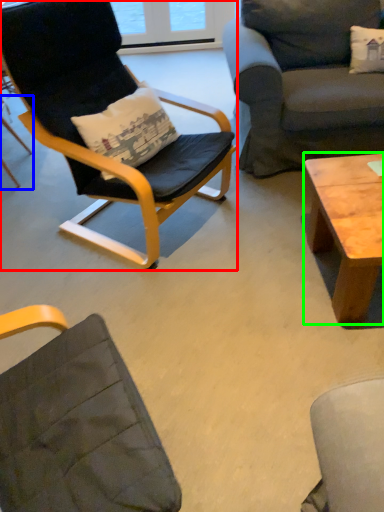
Question: Considering the real-world distances, which object is closest to chair (highlighted by a red box)? chair (highlighted by a blue box) or coffee table (highlighted by a green box).

Choices:
 (A) chair
 (B) coffee table

Answer: (B)